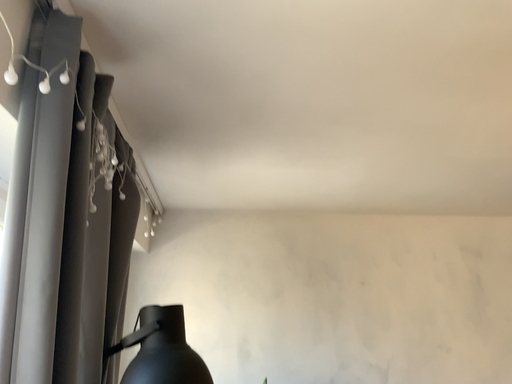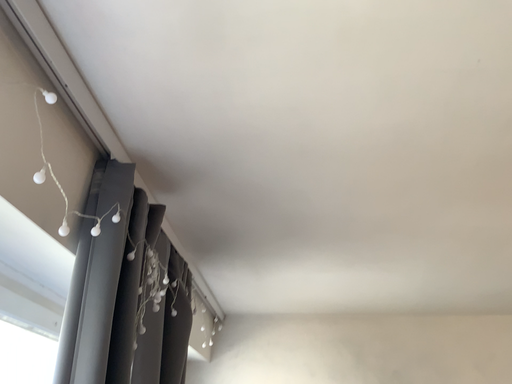
Question: How did the camera likely rotate when shooting the video?

Choices:
 (A) rotated upward
 (B) rotated downward

Answer: (A)